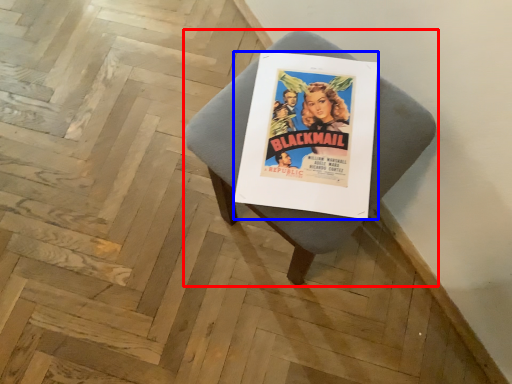
Question: Which of the following is the closest to the observer, furniture (highlighted by a red box) or poster (highlighted by a blue box)?

Choices:
 (A) furniture
 (B) poster

Answer: (A)